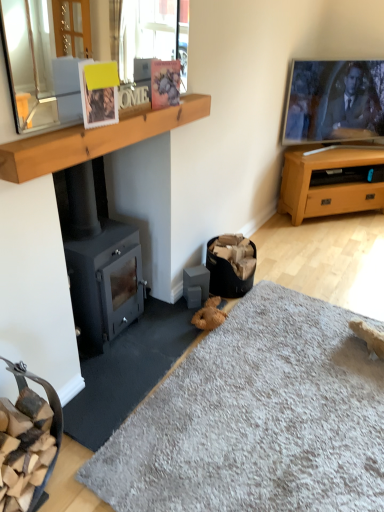
Where is `free point above light brown wood tv stand at right (from a real-world perspective)`? free point above light brown wood tv stand at right (from a real-world perspective) is located at coordinates (340, 147).